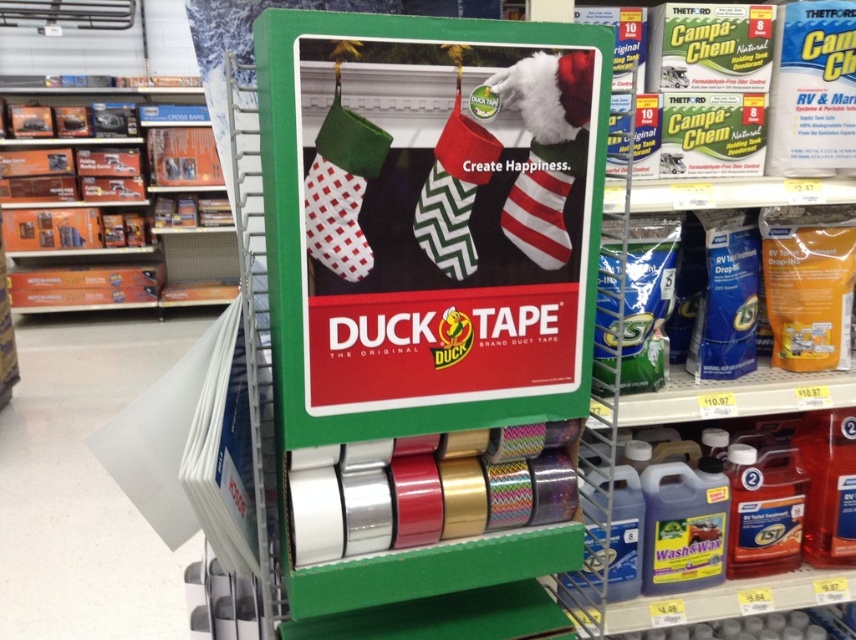
You are a customer at the retail store looking at the Duck Tape display. You see the green matte cardboard at center and the green zigzag fabric sock at center. Which object is positioned lower in the display?

The green matte cardboard at center is positioned lower than the green zigzag fabric sock at center.

What is the color and material of the object located at point (431, 221) in the retail display?

The object at point (431, 221) is green matte cardboard.